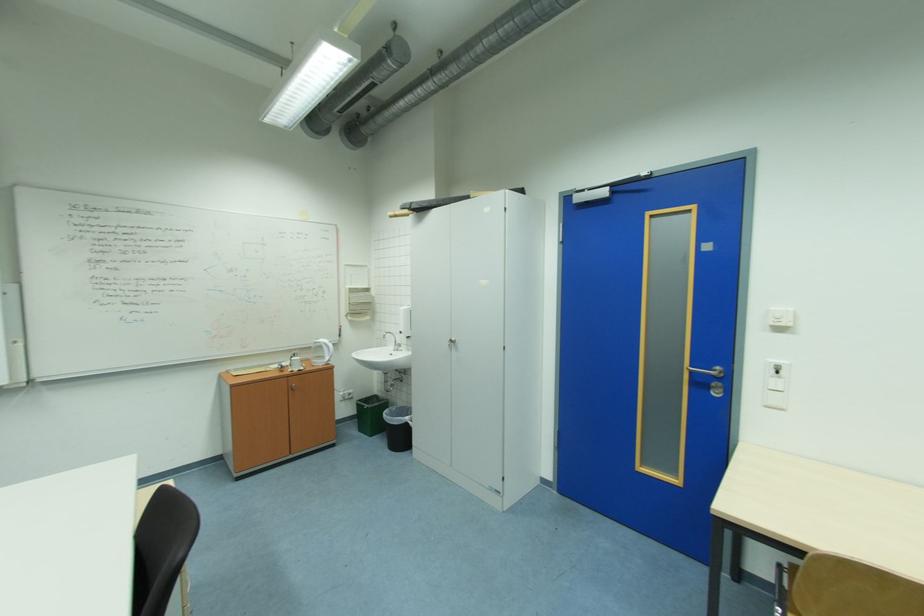
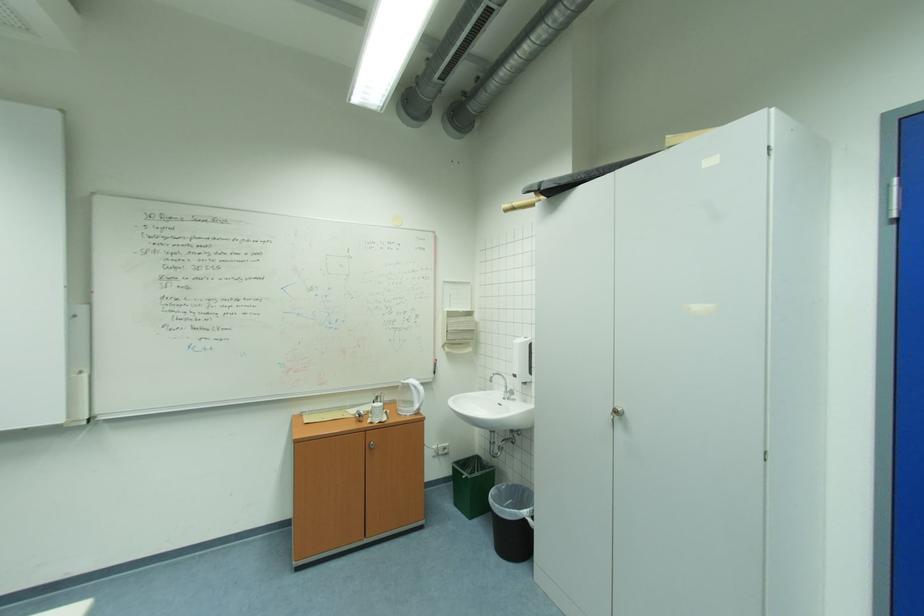
In the second image, find the point that corresponds to pixel 415 419 in the first image.

(532, 513)